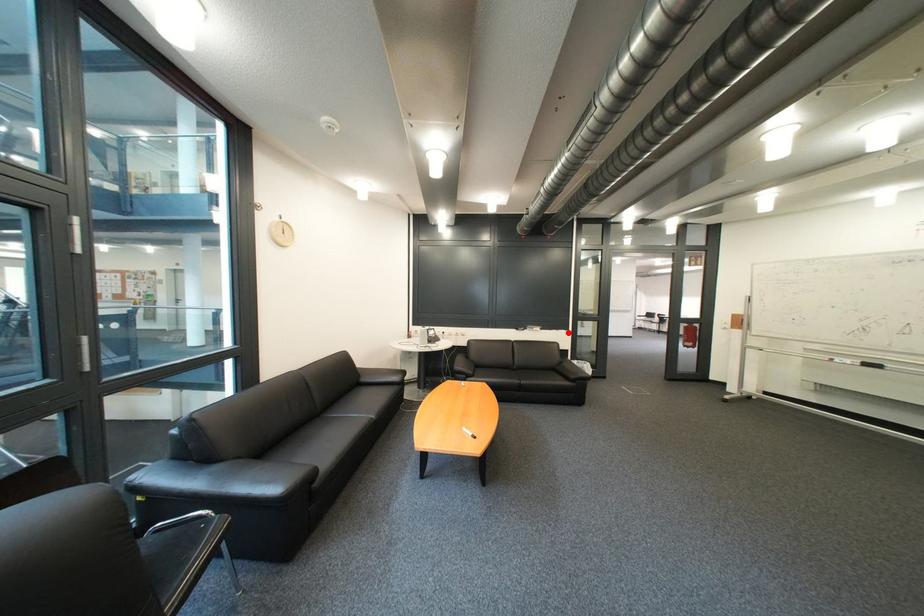
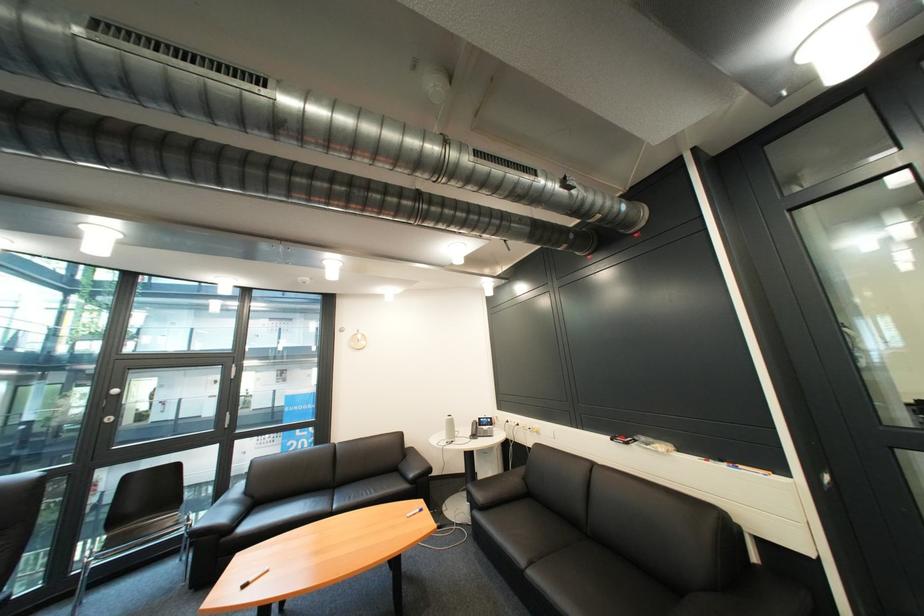
Where in the second image is the point corresponding to the highlighted location from the first image?

(736, 468)